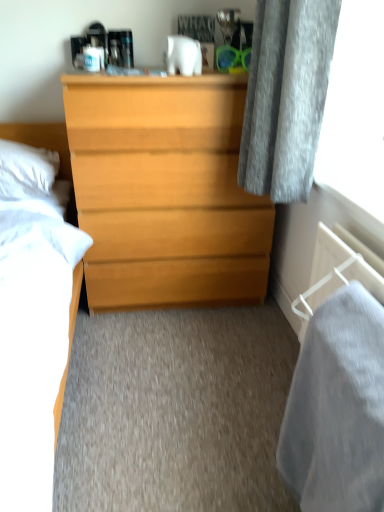
Locate an element on the screen. gray soft fabric at lower right is located at coordinates (337, 408).

Locate an element on the screen. white soft pillow at left is located at coordinates (26, 170).

In the scene shown: From the image's perspective, which one is positioned higher, white soft pillow at left or gray soft fabric at lower right?

white soft pillow at left is shown above in the image.

Is gray soft fabric at lower right at the back of white soft pillow at left?

No, white soft pillow at left is not facing the opposite direction of gray soft fabric at lower right.

Considering the positions of point (48, 163) and point (377, 431), is point (48, 163) closer or farther from the camera than point (377, 431)?

Point (48, 163) appears to be farther away from the viewer than point (377, 431).

Which is behind, white soft pillow at left or gray soft fabric at lower right?

white soft pillow at left is further from the camera.

Is gray soft fabric at lower right looking in the opposite direction of white soft pillow at left?

No, gray soft fabric at lower right is not facing away from white soft pillow at left.

Can you confirm if gray soft fabric at lower right is smaller than white soft pillow at left?

Actually, gray soft fabric at lower right might be larger than white soft pillow at left.

Which is in front, gray soft fabric at lower right or white soft pillow at left?

Positioned in front is gray soft fabric at lower right.

Does gray soft fabric at lower right have a lesser width compared to white soft pillow at left?

Correct, the width of gray soft fabric at lower right is less than that of white soft pillow at left.

Considering the sizes of objects gray soft fabric at lower right and light wood chest of drawers at center in the image provided, who is shorter, gray soft fabric at lower right or light wood chest of drawers at center?

With less height is gray soft fabric at lower right.

Does gray soft fabric at lower right turn towards light wood chest of drawers at center?

No, gray soft fabric at lower right does not turn towards light wood chest of drawers at center.

From a real-world perspective, is gray soft fabric at lower right positioned above or below light wood chest of drawers at center?

gray soft fabric at lower right is situated lower than light wood chest of drawers at center in the real world.

Is light wood chest of drawers at center inside gray soft fabric at lower right?

No, light wood chest of drawers at center is located outside of gray soft fabric at lower right.

Does white soft pillow at left have a smaller size compared to light wood chest of drawers at center?

Correct, white soft pillow at left occupies less space than light wood chest of drawers at center.

Is white soft pillow at left to the left or to the right of light wood chest of drawers at center in the image?

white soft pillow at left is positioned on light wood chest of drawers at center's left side.

Between point (43, 162) and point (202, 120), which one is positioned in front?

The point (202, 120) is closer to the camera.

Is light wood chest of drawers at center looking in the opposite direction of gray soft fabric at lower right?

No.

This screenshot has height=512, width=384. In order to click on sheet located in front of the light wood chest of drawers at center in this screenshot , I will do `click(337, 408)`.

From a real-world perspective, is light wood chest of drawers at center physically below gray soft fabric at lower right?

Actually, light wood chest of drawers at center is physically above gray soft fabric at lower right in the real world.

Is gray soft fabric at lower right a part of light wood chest of drawers at center?

No, light wood chest of drawers at center does not contain gray soft fabric at lower right.

Can you confirm if light wood chest of drawers at center is thinner than white soft pillow at left?

No, light wood chest of drawers at center is not thinner than white soft pillow at left.

Is white soft pillow at left at the back of light wood chest of drawers at center?

No, light wood chest of drawers at center's orientation is not away from white soft pillow at left.

Would you say light wood chest of drawers at center is inside or outside white soft pillow at left?

light wood chest of drawers at center is not enclosed by white soft pillow at left.

You are a GUI agent. You are given a task and a screenshot of the screen. Output one action in this format:
    pyautogui.click(x=<x>, y=<y>)
    Task: Click on the chest of drawers in front of the white soft pillow at left
    This screenshot has height=512, width=384.
    Given the screenshot: What is the action you would take?
    pyautogui.click(x=164, y=191)

This screenshot has height=512, width=384. I want to click on pillow behind the gray soft fabric at lower right, so click(26, 170).

You are a GUI agent. You are given a task and a screenshot of the screen. Output one action in this format:
    pyautogui.click(x=<x>, y=<y>)
    Task: Click on the pillow that is above the gray soft fabric at lower right (from a real-world perspective)
    This screenshot has height=512, width=384.
    Given the screenshot: What is the action you would take?
    pyautogui.click(x=26, y=170)

Based on their spatial positions, is gray soft fabric at lower right or light wood chest of drawers at center further from white soft pillow at left?

Based on the image, gray soft fabric at lower right appears to be further to white soft pillow at left.

Estimate the real-world distances between objects in this image. Which object is closer to light wood chest of drawers at center, white soft pillow at left or gray soft fabric at lower right?

The object closer to light wood chest of drawers at center is white soft pillow at left.

Consider the image. Considering their positions, is white soft pillow at left positioned closer to gray soft fabric at lower right than light wood chest of drawers at center?

light wood chest of drawers at center lies closer to gray soft fabric at lower right than the other object.

Which object lies further to the anchor point gray soft fabric at lower right, light wood chest of drawers at center or white soft pillow at left?

white soft pillow at left is positioned further to the anchor gray soft fabric at lower right.

Looking at the image, which one is located closer to light wood chest of drawers at center, gray soft fabric at lower right or white soft pillow at left?

white soft pillow at left lies closer to light wood chest of drawers at center than the other object.

Which object lies further to the anchor point white soft pillow at left, light wood chest of drawers at center or gray soft fabric at lower right?

gray soft fabric at lower right is positioned further to the anchor white soft pillow at left.

In order to click on chest of drawers between white soft pillow at left and gray soft fabric at lower right from left to right in this screenshot , I will do `click(164, 191)`.